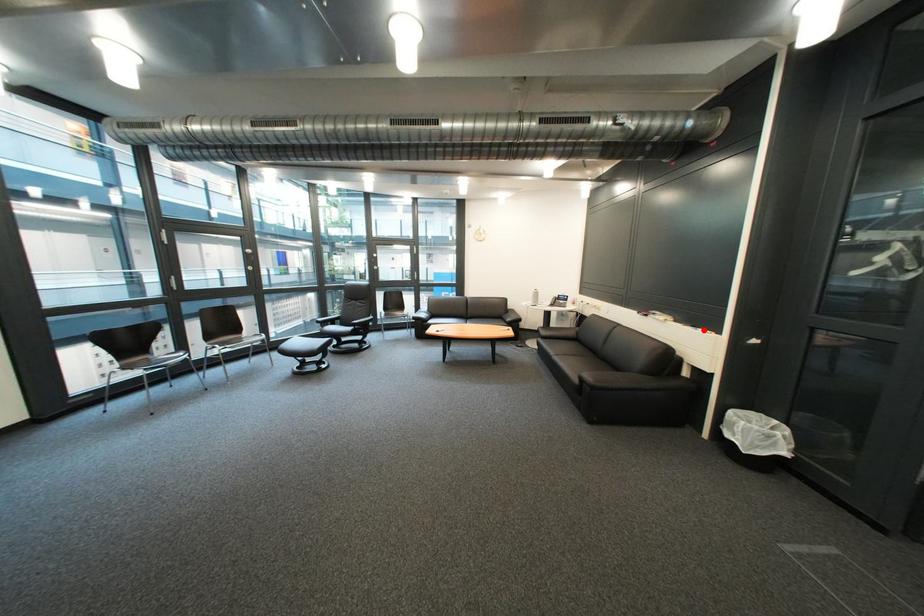
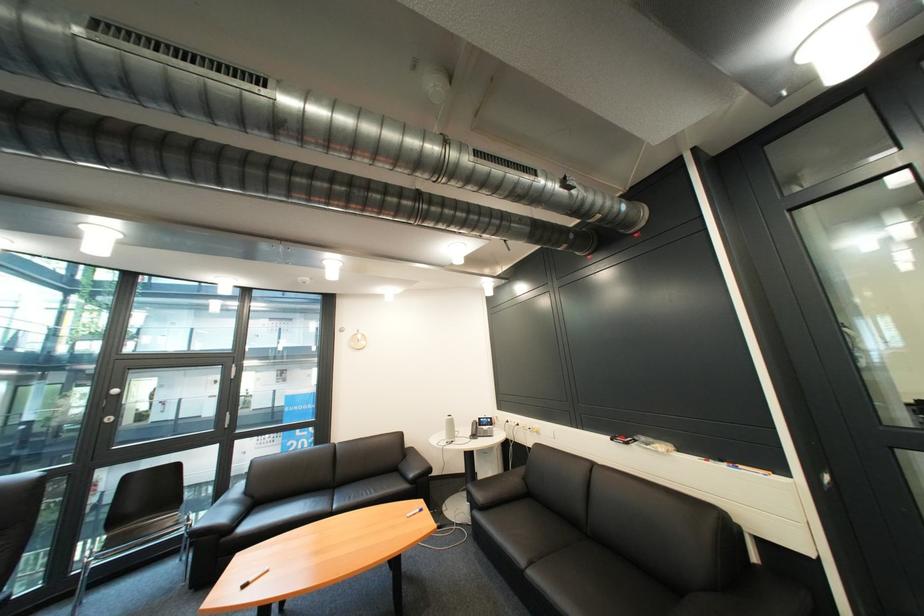
Where in the second image is the point corresponding to the highlighted location from the first image?

(736, 468)